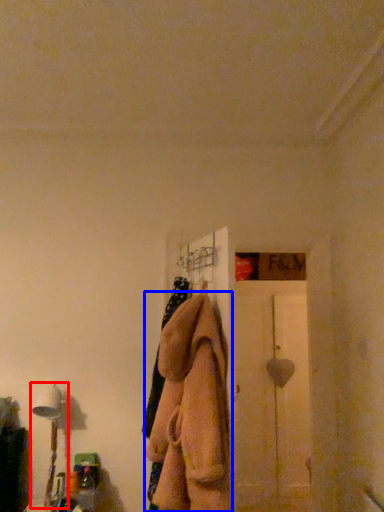
Question: Which object is closer to the camera taking this photo, table lamp (highlighted by a red box) or clothing (highlighted by a blue box)?

Choices:
 (A) table lamp
 (B) clothing

Answer: (B)